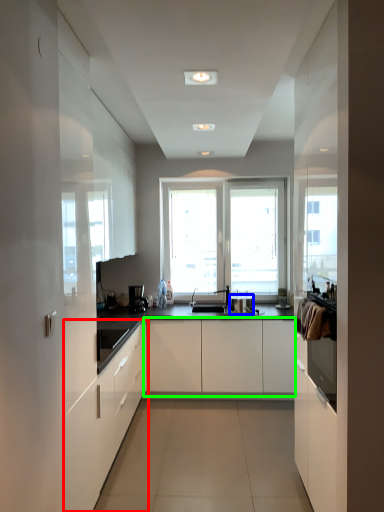
Question: Which object is the farthest from cabinetry (highlighted by a red box)? Choose among these: appliance (highlighted by a blue box) or cabinetry (highlighted by a green box).

Choices:
 (A) appliance
 (B) cabinetry

Answer: (A)